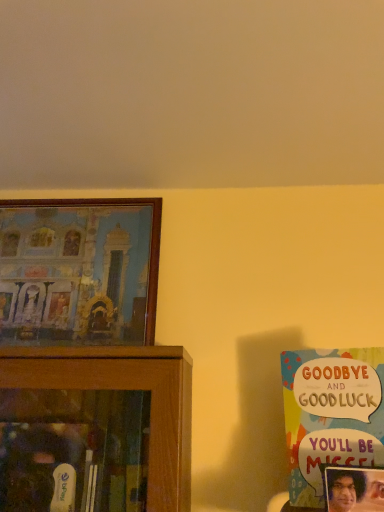
Question: Is wooden framed painting at left, the 2th picture frame from the right, oriented away from matte plastic picture frame at lower right, the first picture frame ordered from the bottom?

Choices:
 (A) yes
 (B) no

Answer: (B)

Question: Can you confirm if wooden framed painting at left, which is the 1th picture frame in back-to-front order, is positioned to the left of matte plastic picture frame at lower right, the 2th picture frame in the left-to-right sequence?

Choices:
 (A) no
 (B) yes

Answer: (B)

Question: Is wooden framed painting at left, which is the 1th picture frame in back-to-front order, thinner than matte plastic picture frame at lower right, the first picture frame ordered from the bottom?

Choices:
 (A) no
 (B) yes

Answer: (A)

Question: Does wooden framed painting at left, which is the 1th picture frame in back-to-front order, have a greater width compared to matte plastic picture frame at lower right, the first picture frame ordered from the bottom?

Choices:
 (A) no
 (B) yes

Answer: (B)

Question: Is the position of wooden framed painting at left, arranged as the 1th picture frame when viewed from the top, less distant than that of matte plastic picture frame at lower right, the first picture frame ordered from the bottom?

Choices:
 (A) no
 (B) yes

Answer: (A)

Question: Is wooden framed painting at left, which is the 1th picture frame in back-to-front order, aimed at matte plastic picture frame at lower right, the 2th picture frame in the left-to-right sequence?

Choices:
 (A) no
 (B) yes

Answer: (A)

Question: Is wooden framed painting at left, the 2th picture frame from the right, located within multicolored paper card at right?

Choices:
 (A) yes
 (B) no

Answer: (B)

Question: Would you say multicolored paper card at right is a long distance from wooden framed painting at left, which is the 1th picture frame in back-to-front order?

Choices:
 (A) no
 (B) yes

Answer: (A)

Question: Considering the relative positions of multicolored paper card at right and wooden framed painting at left, the 2th picture frame from the right, in the image provided, is multicolored paper card at right to the right of wooden framed painting at left, the 2th picture frame from the right, from the viewer's perspective?

Choices:
 (A) no
 (B) yes

Answer: (B)

Question: From a real-world perspective, is multicolored paper card at right located beneath wooden framed painting at left, the 2th picture frame from the right?

Choices:
 (A) no
 (B) yes

Answer: (B)

Question: Can you confirm if multicolored paper card at right is taller than wooden framed painting at left, marked as the second picture frame in a front-to-back arrangement?

Choices:
 (A) no
 (B) yes

Answer: (A)

Question: From the image's perspective, is multicolored paper card at right below wooden framed painting at left, marked as the second picture frame in a front-to-back arrangement?

Choices:
 (A) no
 (B) yes

Answer: (B)

Question: Does matte plastic picture frame at lower right, arranged as the 2th picture frame when viewed from the top, lie in front of wooden framed painting at left, marked as the second picture frame in a front-to-back arrangement?

Choices:
 (A) yes
 (B) no

Answer: (A)